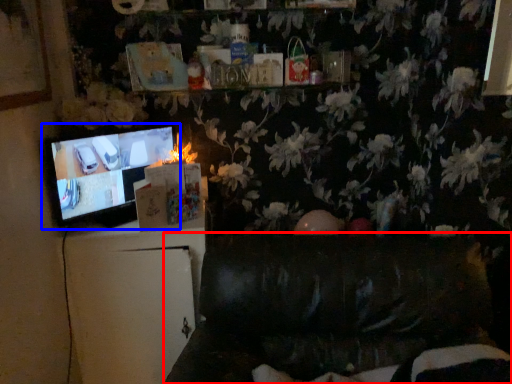
Question: Which point is further to the camera, furniture (highlighted by a red box) or television (highlighted by a blue box)?

Choices:
 (A) furniture
 (B) television

Answer: (B)